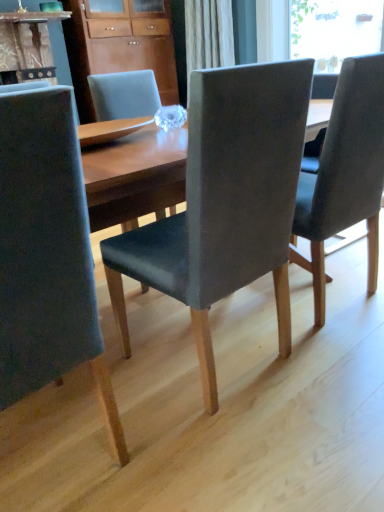
Question: Does matte wood cabinet at upper center have a greater height compared to matte gray chair at center, positioned as the second chair in right-to-left order?

Choices:
 (A) no
 (B) yes

Answer: (B)

Question: Is matte wood cabinet at upper center next to matte gray chair at center, positioned as the second chair in right-to-left order, and touching it?

Choices:
 (A) no
 (B) yes

Answer: (A)

Question: Does matte wood cabinet at upper center have a greater width compared to matte gray chair at center, positioned as the second chair in right-to-left order?

Choices:
 (A) no
 (B) yes

Answer: (A)

Question: Is matte wood cabinet at upper center thinner than matte gray chair at center, acting as the second chair starting from the left?

Choices:
 (A) no
 (B) yes

Answer: (B)

Question: From a real-world perspective, does matte wood cabinet at upper center stand above matte gray chair at center, acting as the second chair starting from the left?

Choices:
 (A) yes
 (B) no

Answer: (A)

Question: Is dark gray fabric chair at center, acting as the third chair starting from the left, inside the boundaries of matte wood cabinet at upper center, or outside?

Choices:
 (A) inside
 (B) outside

Answer: (B)

Question: Is dark gray fabric chair at center, acting as the 1th chair starting from the right, in front of or behind matte wood cabinet at upper center in the image?

Choices:
 (A) behind
 (B) front

Answer: (B)

Question: From the image's perspective, is dark gray fabric chair at center, acting as the 1th chair starting from the right, located above or below matte wood cabinet at upper center?

Choices:
 (A) below
 (B) above

Answer: (A)

Question: Considering the positions of point (375, 243) and point (134, 35), is point (375, 243) closer or farther from the camera than point (134, 35)?

Choices:
 (A) closer
 (B) farther

Answer: (A)

Question: In terms of width, does matte gray chair at left, which appears as the third chair when viewed from the right, look wider or thinner when compared to dark gray fabric chair at center, acting as the 1th chair starting from the right?

Choices:
 (A) wide
 (B) thin

Answer: (A)

Question: Considering the positions of matte gray chair at left, which appears as the third chair when viewed from the right, and dark gray fabric chair at center, acting as the 1th chair starting from the right, in the image, is matte gray chair at left, which appears as the third chair when viewed from the right, taller or shorter than dark gray fabric chair at center, acting as the 1th chair starting from the right,?

Choices:
 (A) tall
 (B) short

Answer: (A)

Question: From a real-world perspective, is matte gray chair at left, arranged as the 1th chair when viewed from the left, physically located above or below dark gray fabric chair at center, acting as the 1th chair starting from the right?

Choices:
 (A) above
 (B) below

Answer: (A)

Question: Visually, is matte gray chair at left, which appears as the third chair when viewed from the right, positioned to the left or to the right of dark gray fabric chair at center, acting as the third chair starting from the left?

Choices:
 (A) right
 (B) left

Answer: (B)

Question: Is matte wood cabinet at upper center in front of or behind transparent glass window at upper right in the image?

Choices:
 (A) front
 (B) behind

Answer: (B)

Question: Is matte wood cabinet at upper center inside or outside of transparent glass window at upper right?

Choices:
 (A) inside
 (B) outside

Answer: (B)